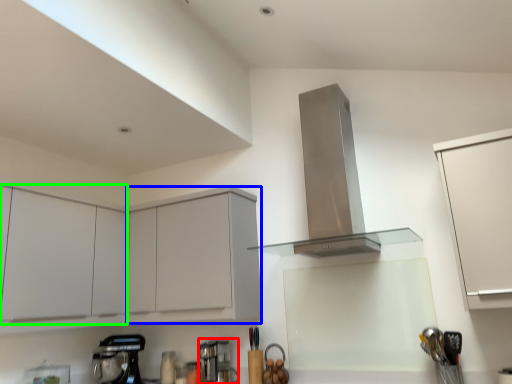
Question: Which is nearer to the coffee machine (highlighted by a red box)? cabinetry (highlighted by a blue box) or cabinetry (highlighted by a green box).

Choices:
 (A) cabinetry
 (B) cabinetry

Answer: (A)